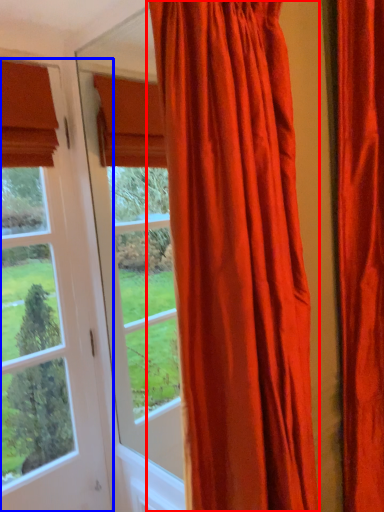
Question: Which object appears closest to the camera in this image, curtain (highlighted by a red box) or window (highlighted by a blue box)?

Choices:
 (A) curtain
 (B) window

Answer: (A)